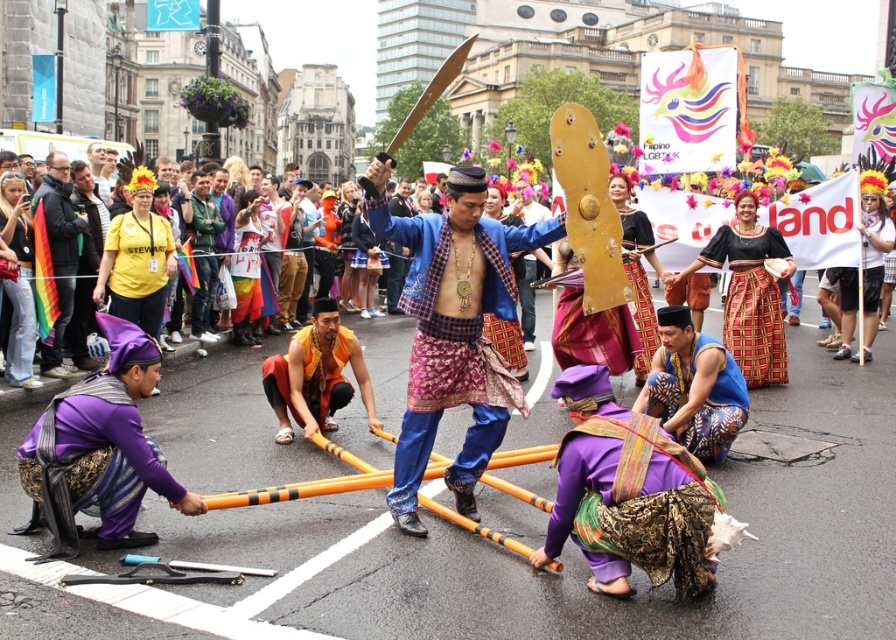
Question: Which object appears closest to the camera in this image?

Choices:
 (A) rainbow flag at left
 (B) shiny blue fabric at center

Answer: (B)

Question: Is shiny blue fabric at center positioned behind rainbow flag at left?

Choices:
 (A) yes
 (B) no

Answer: (B)

Question: Can you confirm if shiny blue fabric at center is positioned to the right of rainbow flag at left?

Choices:
 (A) yes
 (B) no

Answer: (A)

Question: Is shiny blue fabric at center in front of rainbow flag at left?

Choices:
 (A) no
 (B) yes

Answer: (B)